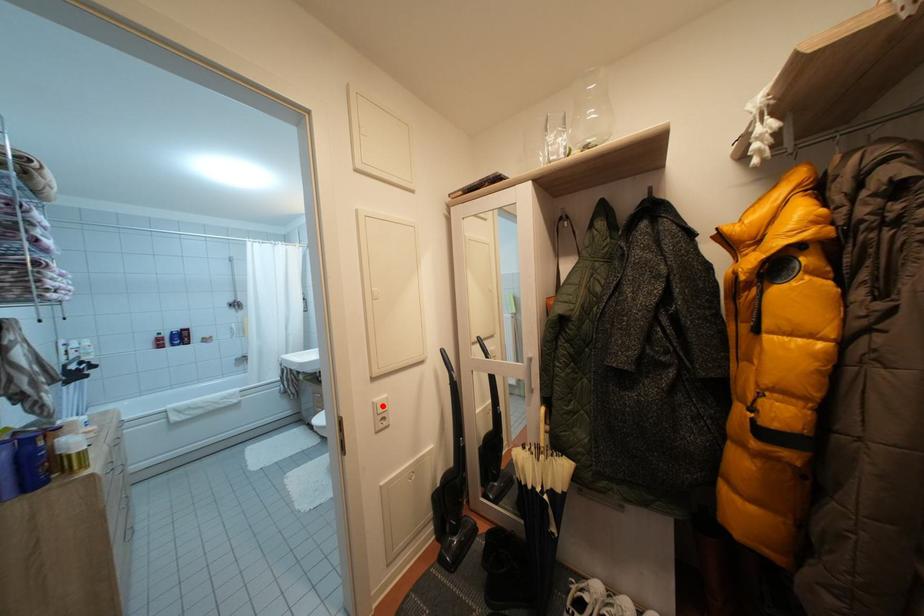
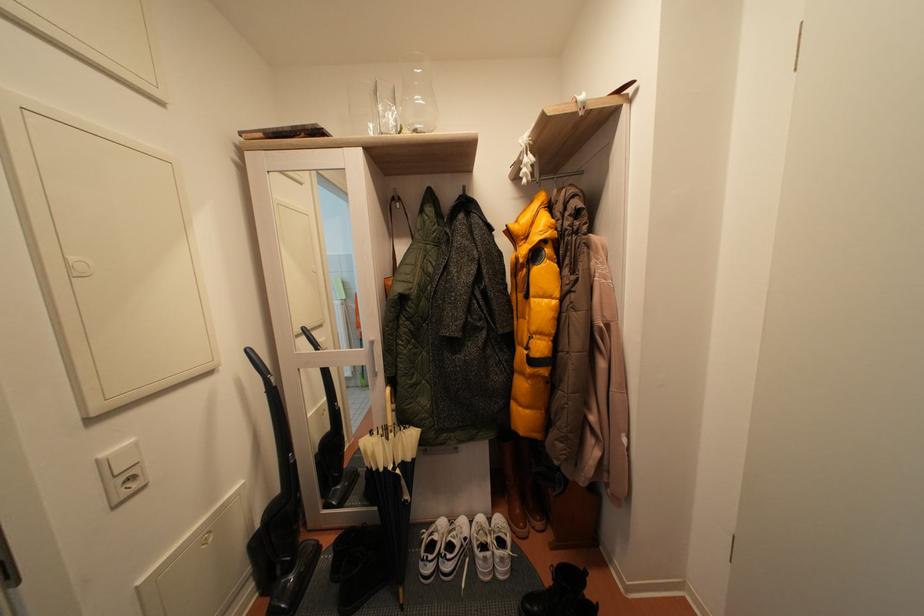
Find the pixel in the second image that matches the highlighted location in the first image.

(111, 460)